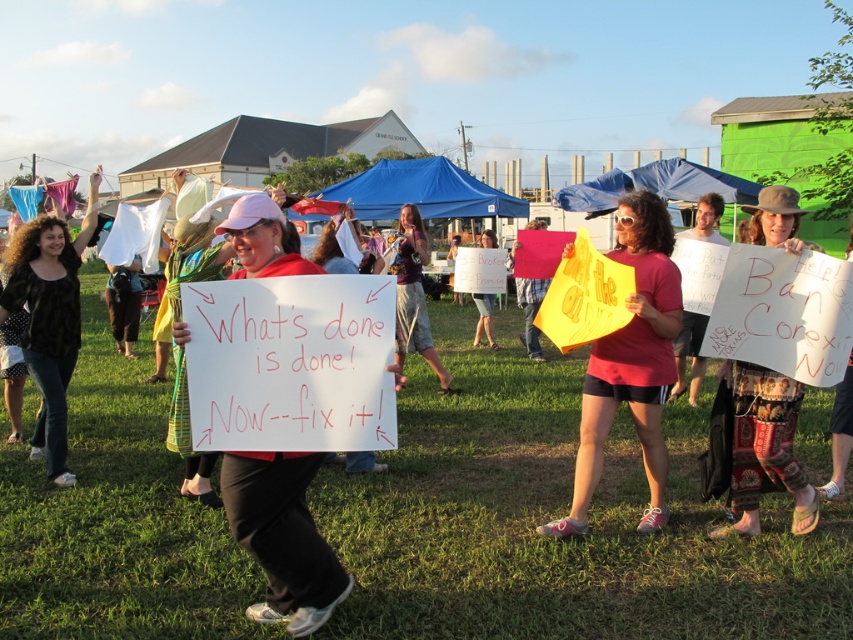
You are a photographer at the protest scene. You want to take a photo that captures both the matte yellow sign at center and the black leopard print shirt at left. Which object should you focus on first to ensure both are in frame?

The matte yellow sign at center is bigger than the black leopard print shirt at left, so you should focus on the matte yellow sign at center first to ensure both are in frame.

You are a photographer trying to capture the protest scene. You want to ensure that both the green grass at center and the white paper sign at center are clearly visible in your photo. Based on their positions, which object should you focus on first to ensure both are in focus?

The green grass at center is below the white paper sign at center, so focusing on the white paper sign at center first will help ensure both are in focus since it is closer to the camera.

You are a photographer trying to capture a clear shot of both the green grass at center and the white paper sign at center. Based on their positions, which object should you focus on first to ensure both are in frame?

Since the green grass at center is to the right of white paper sign at center, you should focus on the white paper sign at center first and then pan slightly to the right to include the green grass at center in the frame.